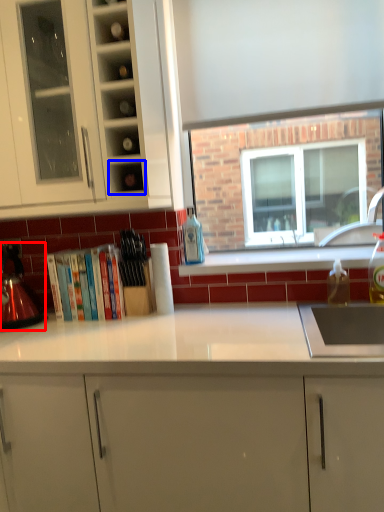
Question: Which of the following is the farthest to the observer, kitchen appliance (highlighted by a red box) or shelf (highlighted by a blue box)?

Choices:
 (A) kitchen appliance
 (B) shelf

Answer: (A)